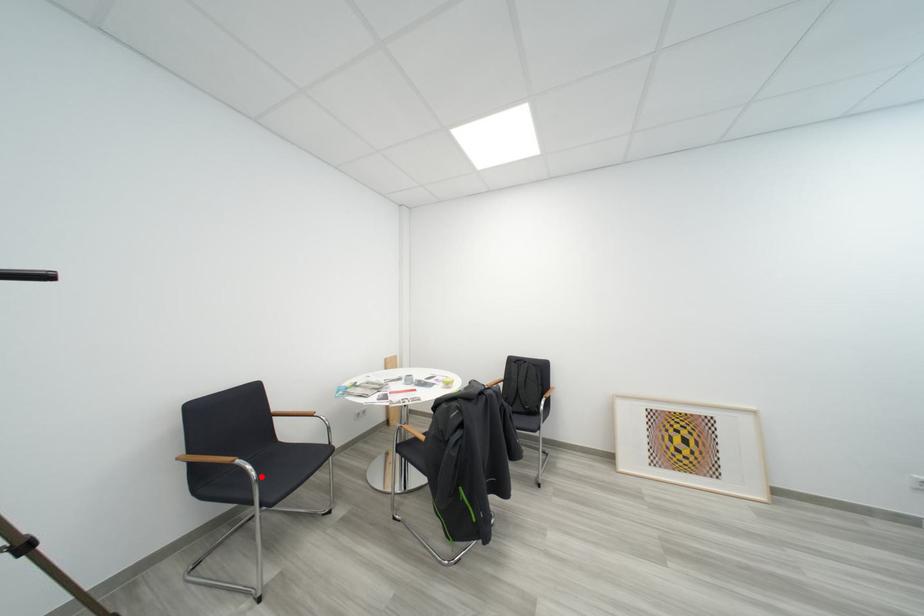
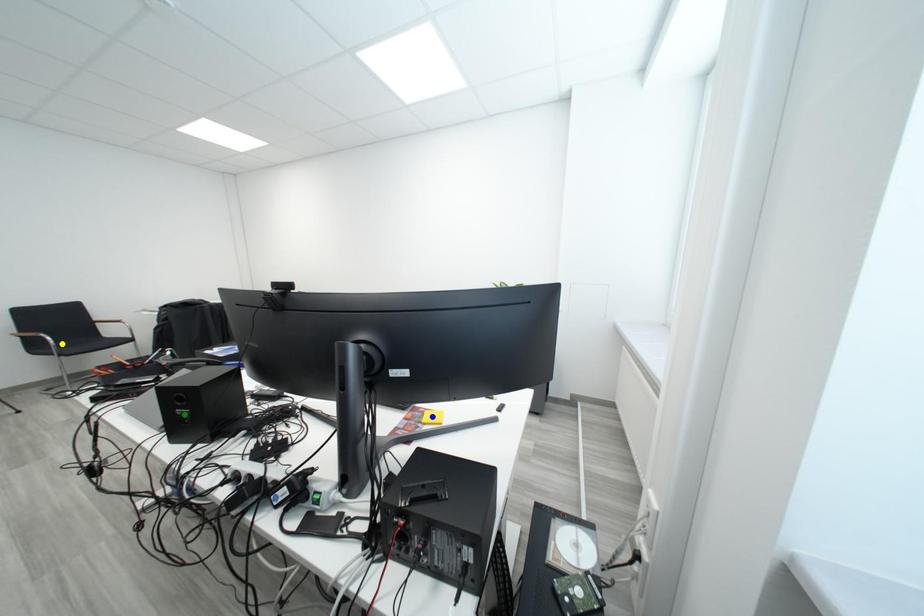
Question: I am providing you with two images of the same scene from different viewpoints. A red point is marked on the first image. You are given multiple points on the second image. Which spot in image 2 lines up with the point in image 1?

Choices:
 (A) blue point
 (B) yellow point
 (C) green point

Answer: (B)